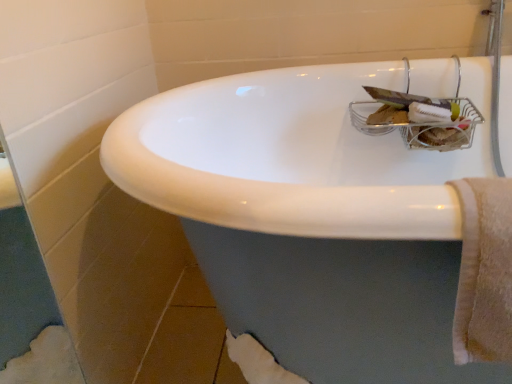
This screenshot has width=512, height=384. Identify the location of white glossy bathtub at center. (310, 219).

Describe the element at coordinates (310, 219) in the screenshot. I see `white glossy bathtub at center` at that location.

You are a GUI agent. You are given a task and a screenshot of the screen. Output one action in this format:
    pyautogui.click(x=<x>, y=<y>)
    Task: Click on the white glossy bathtub at center
    
    Given the screenshot: What is the action you would take?
    pyautogui.click(x=310, y=219)